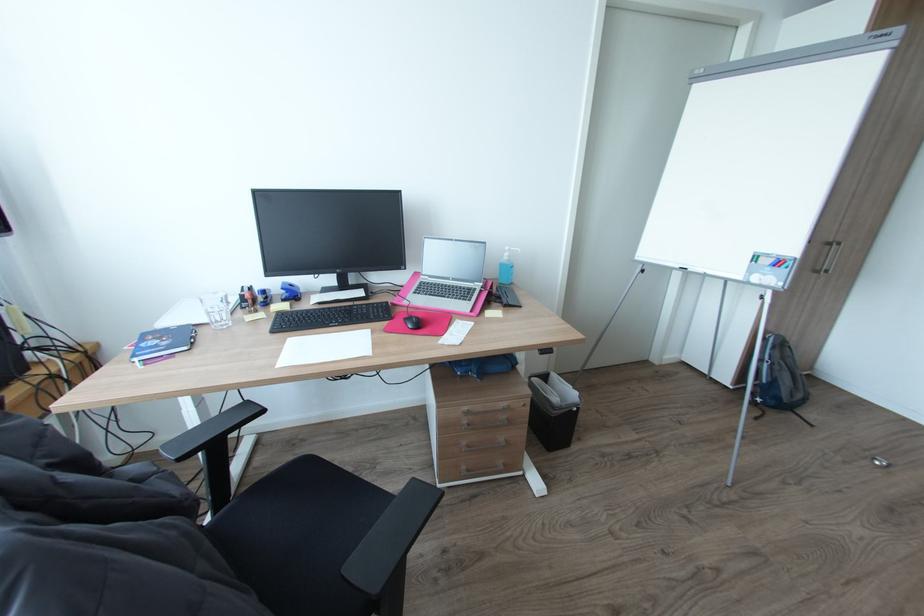
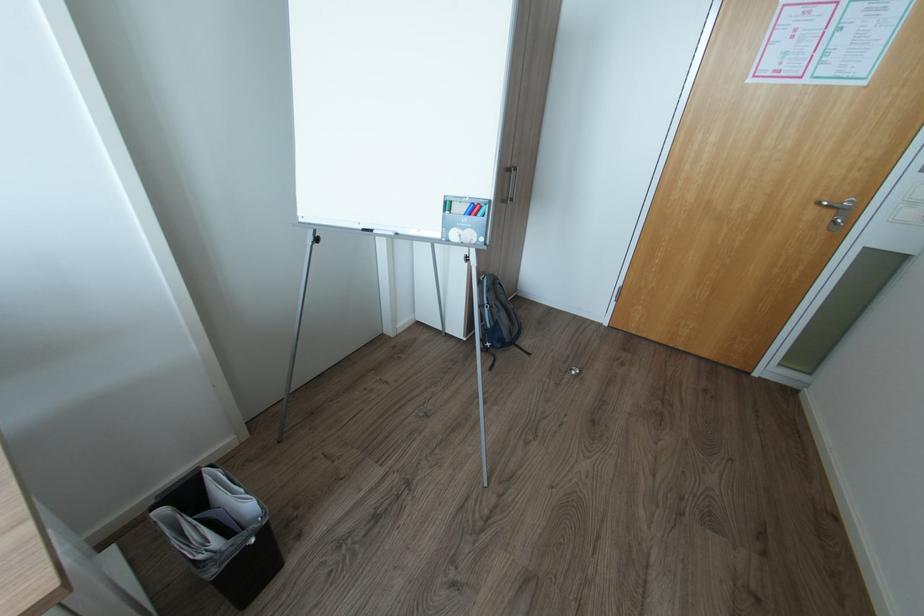
Find the pixel in the second image that matches the point at 580,408 in the first image.

(257, 541)